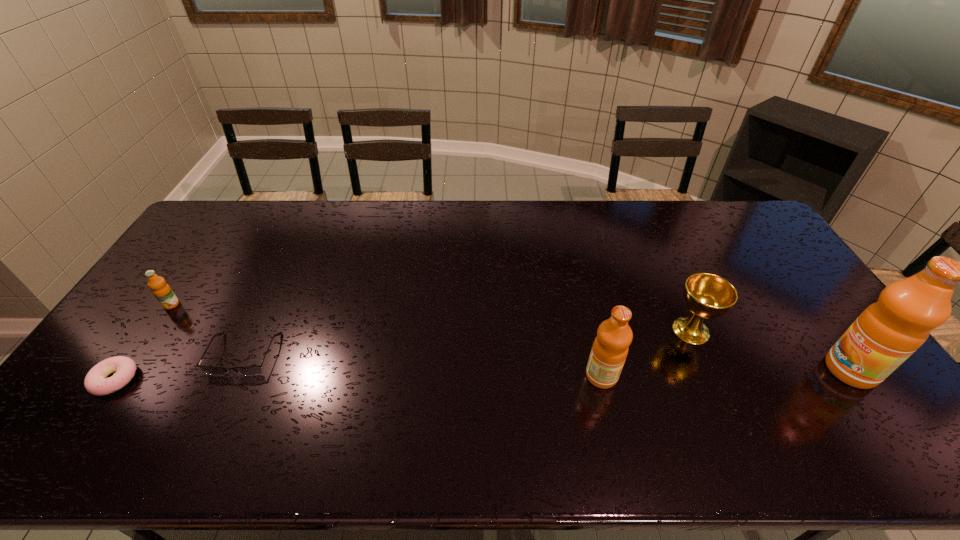
At what (x,y) coordinates should I click in order to perform the action: click on doughnut present at the left edge. Please return your answer as a coordinate pair (x, y). The width and height of the screenshot is (960, 540). Looking at the image, I should click on (96, 383).

Locate an element on the screen. Image resolution: width=960 pixels, height=540 pixels. object positioned at the right edge is located at coordinates (887, 332).

Where is `object that is at the near left corner`? This screenshot has width=960, height=540. object that is at the near left corner is located at coordinates (96, 383).

The width and height of the screenshot is (960, 540). Identify the location of object present at the near right corner. (887, 332).

You are a GUI agent. You are given a task and a screenshot of the screen. Output one action in this format:
    pyautogui.click(x=<x>, y=<y>)
    Task: Click on the vacant space at the far edge of the desktop
    This screenshot has width=960, height=540.
    Given the screenshot: What is the action you would take?
    pyautogui.click(x=471, y=238)

Locate an element on the screen. The width and height of the screenshot is (960, 540). vacant region at the near edge is located at coordinates (291, 389).

Find the location of a particular element. Image resolution: width=960 pixels, height=540 pixels. vacant space at the left edge is located at coordinates (200, 242).

Locate an element on the screen. The image size is (960, 540). empty location between the doughnut and the farthest object is located at coordinates (143, 342).

Where is `vacant area that lies between the chalice and the third object from right to left`? This screenshot has width=960, height=540. vacant area that lies between the chalice and the third object from right to left is located at coordinates (646, 353).

Locate an element on the screen. This screenshot has height=540, width=960. free spot between the chalice and the third object from left to right is located at coordinates (468, 342).